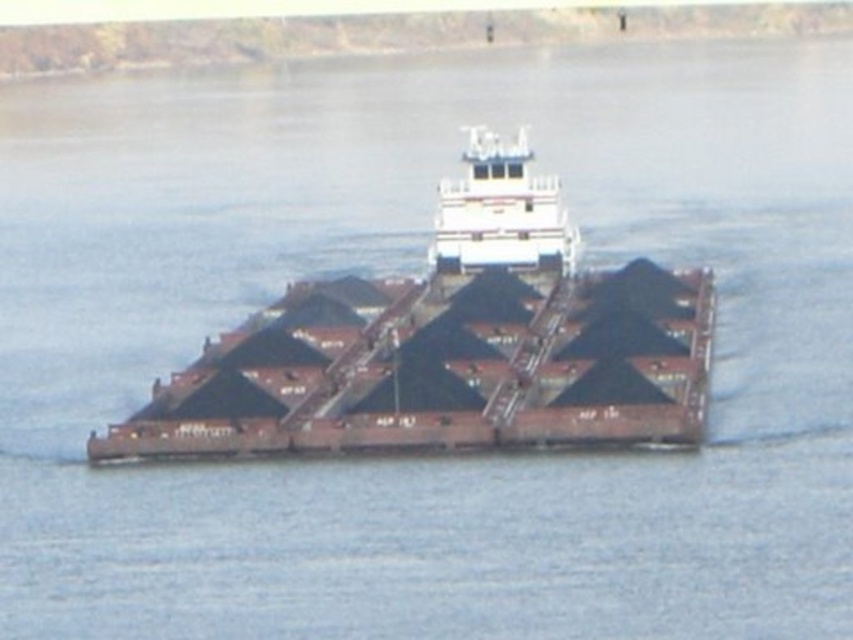
Which is more to the right, brown matte cargo ship at center or white matte barge at center?

white matte barge at center

Who is more forward, (218, 378) or (531, 256)?

Point (218, 378) is in front.

Locate an element on the screen. brown matte cargo ship at center is located at coordinates (451, 346).